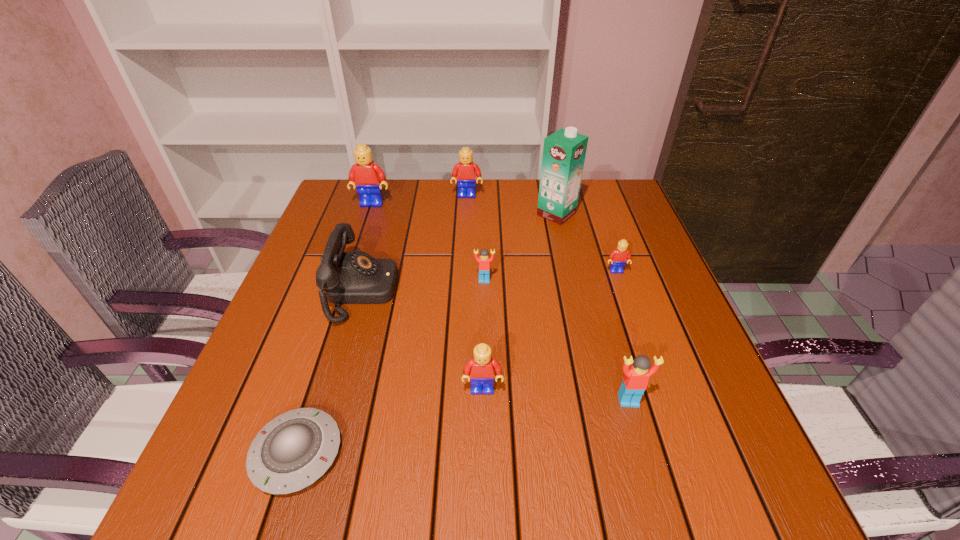
Identify which yellow Lego is the second closest to the smaller red Lego. Please provide its 2D coordinates. Your answer should be formatted as a tuple, i.e. [(x, y)], where the tuple contains the x and y coordinates of a point satisfying the conditions above.

[(481, 369)]

Choose which yellow Lego is the third nearest neighbor to the tallest object. Please provide its 2D coordinates. Your answer should be formatted as a tuple, i.e. [(x, y)], where the tuple contains the x and y coordinates of a point satisfying the conditions above.

[(365, 175)]

This screenshot has width=960, height=540. I want to click on free location that satisfies the following two spatial constraints: 1. on the front-facing side of the second farthest Lego; 2. on the right side of the carton, so click(x=369, y=214).

Image resolution: width=960 pixels, height=540 pixels. What are the coordinates of `free location that satisfies the following two spatial constraints: 1. on the face of the smaller red Lego; 2. on the dial of the telephone` in the screenshot? It's located at (484, 291).